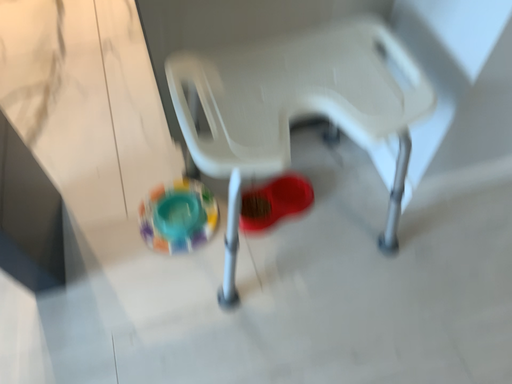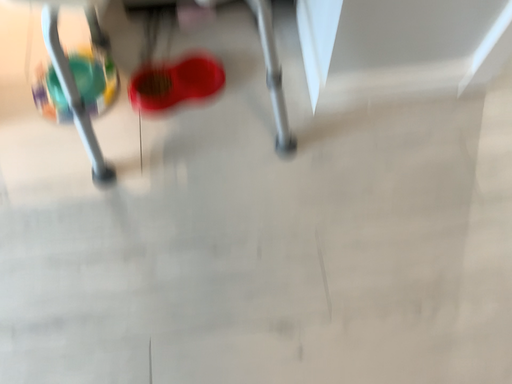
Question: Which way did the camera rotate in the video?

Choices:
 (A) rotated downward
 (B) rotated upward

Answer: (A)